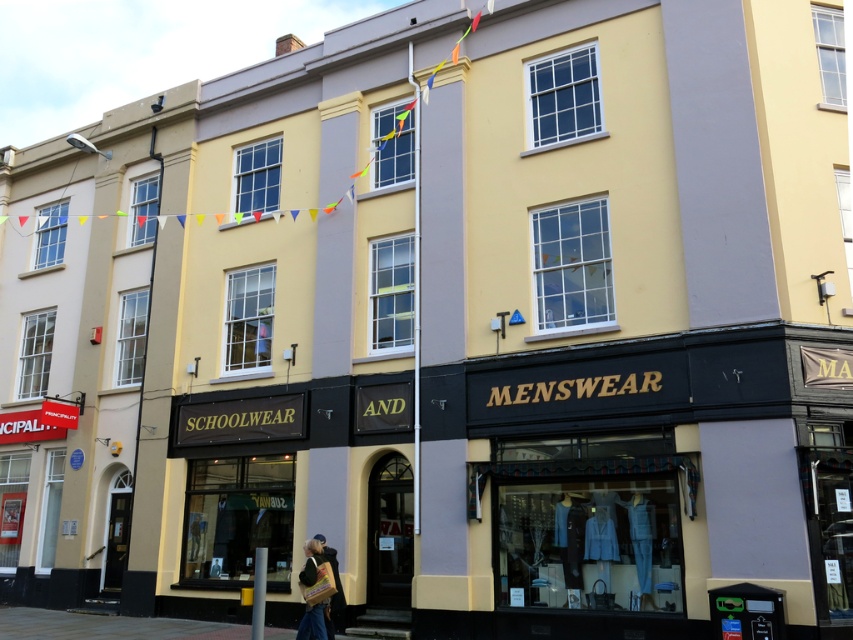
This screenshot has height=640, width=853. What do you see at coordinates (312, 621) in the screenshot? I see `leather jacket at lower center` at bounding box center [312, 621].

Can you confirm if leather jacket at lower center is positioned above denim jacket at lower center?

No.

Describe the element at coordinates (312, 621) in the screenshot. I see `leather jacket at lower center` at that location.

Locate an element on the screen. The image size is (853, 640). leather jacket at lower center is located at coordinates (312, 621).